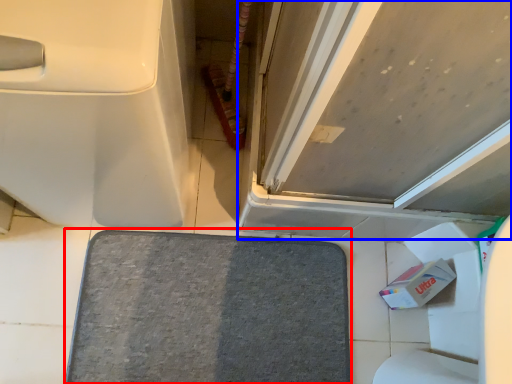
Question: Which object appears closest to the camera in this image, bath mat (highlighted by a red box) or door (highlighted by a blue box)?

Choices:
 (A) bath mat
 (B) door

Answer: (B)